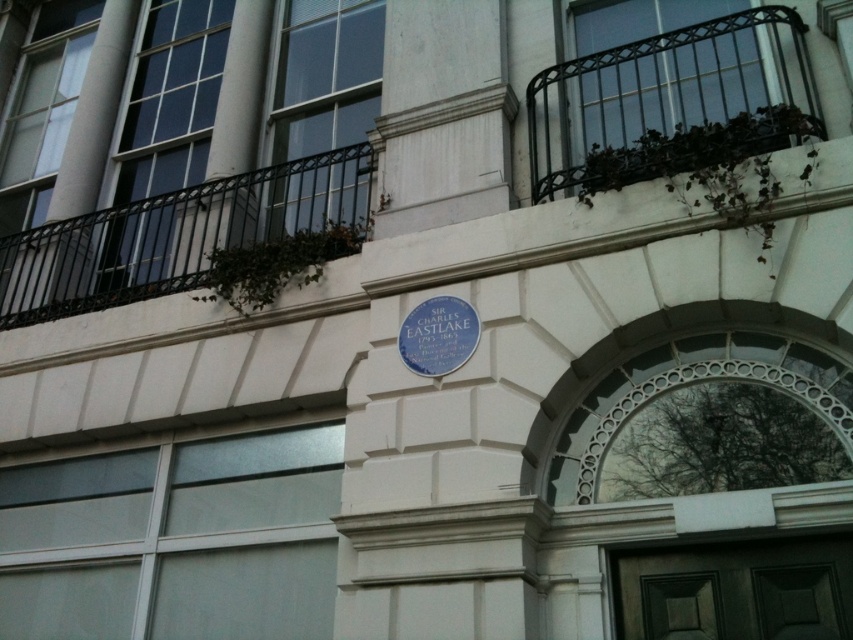
Question: Can you confirm if black wrought iron balcony at upper right is bigger than blue plaque at center?

Choices:
 (A) no
 (B) yes

Answer: (B)

Question: Based on their relative distances, which object is nearer to the dark wood door at lower center?

Choices:
 (A) blue plaque at center
 (B) black wrought iron balcony at upper right

Answer: (A)

Question: Which point is closer to the camera?

Choices:
 (A) black wrought iron balcony at upper left
 (B) blue plaque at center

Answer: (B)

Question: Among these objects, which one is farthest from the camera?

Choices:
 (A) black wrought iron balcony at upper left
 (B) blue plaque at center
 (C) dark wood door at lower center

Answer: (A)

Question: Is the position of dark wood door at lower center more distant than that of blue plaque at center?

Choices:
 (A) yes
 (B) no

Answer: (B)

Question: Is black wrought iron balcony at upper left wider than blue plaque at center?

Choices:
 (A) yes
 (B) no

Answer: (A)